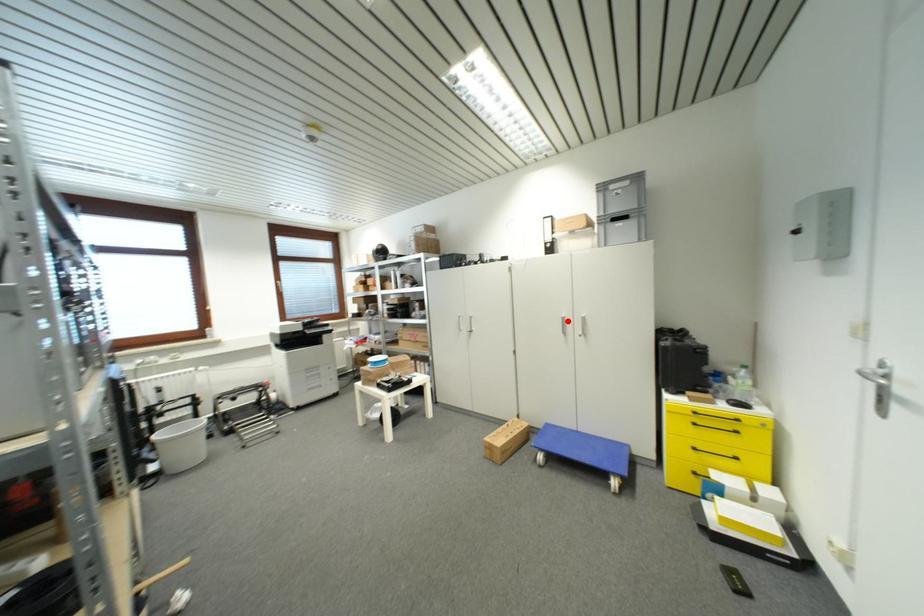
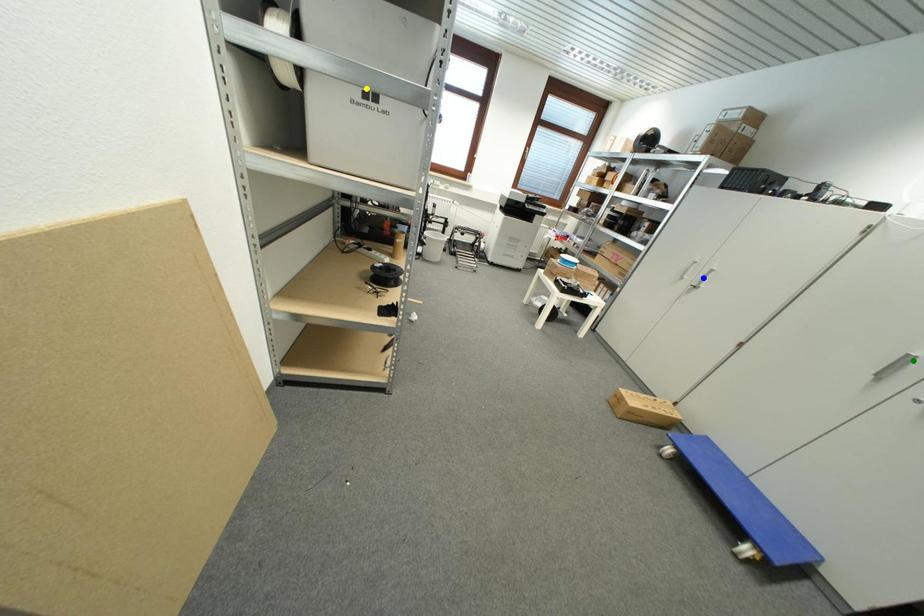
Question: I am providing you with two images of the same scene from different viewpoints. A red point is marked on the first image. You are given multiple points on the second image. Can you choose the point in image 2 that corresponds to the point in image 1?

Choices:
 (A) yellow point
 (B) green point
 (C) blue point

Answer: (B)